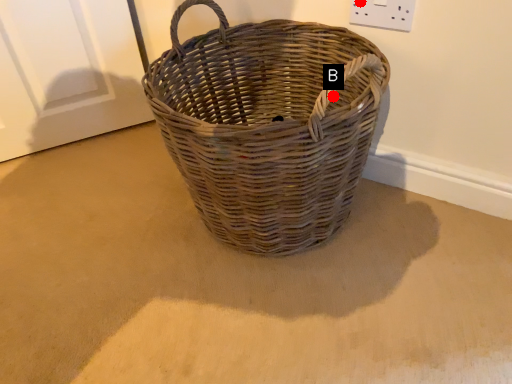
Question: Two points are circled on the image, labeled by A and B beside each circle. Among these points, which one is farthest from the camera?

Choices:
 (A) A is further
 (B) B is further

Answer: (B)